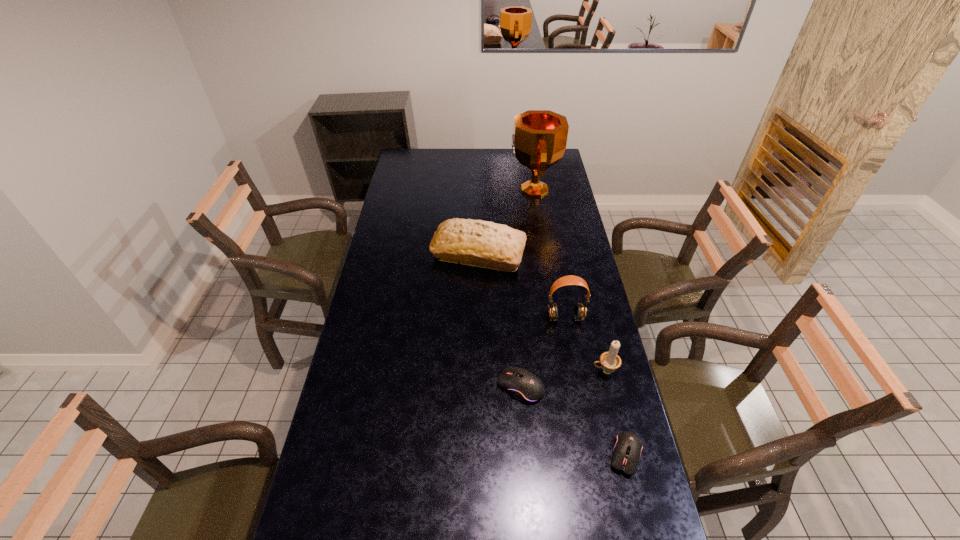
The width and height of the screenshot is (960, 540). In order to click on the left computer mouse in this screenshot , I will do `click(524, 386)`.

Identify the location of the second shortest object. (524, 386).

At what (x,y) coordinates should I click in order to perform the action: click on the right computer mouse. Please return your answer as a coordinate pair (x, y). This screenshot has width=960, height=540. Looking at the image, I should click on (627, 448).

The width and height of the screenshot is (960, 540). I want to click on the shortest object, so click(x=627, y=448).

At what (x,y) coordinates should I click in order to perform the action: click on the second farthest object. Please return your answer as a coordinate pair (x, y). The image size is (960, 540). Looking at the image, I should click on (477, 243).

Find the location of a particular element. the tallest object is located at coordinates (539, 138).

Identify the location of award. This screenshot has width=960, height=540. (539, 138).

Find the location of a particular element. Image resolution: width=960 pixels, height=540 pixels. headset is located at coordinates (580, 309).

The width and height of the screenshot is (960, 540). I want to click on the third farthest object, so click(580, 309).

Where is `candle_holder`? This screenshot has height=540, width=960. candle_holder is located at coordinates (610, 361).